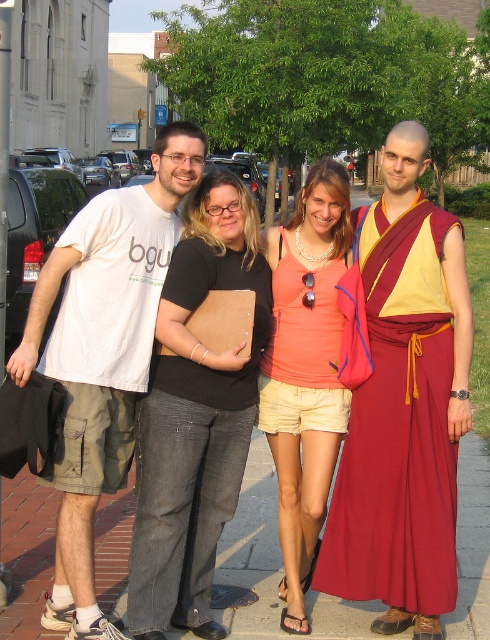
Which of these two, black cotton shirt at center or matte coral tank top at center, stands taller?

With more height is matte coral tank top at center.

From the picture: Is black cotton shirt at center smaller than matte coral tank top at center?

No.

Locate an element on the screen. black cotton shirt at center is located at coordinates (196, 416).

How much distance is there between white t-shirt at left and matte coral tank top at center?

They are 1.57 meters apart.

At what (x,y) coordinates should I click in order to perform the action: click on white t-shirt at left. Please return your answer as a coordinate pair (x, y). The width and height of the screenshot is (490, 640). Looking at the image, I should click on (102, 353).

You are a GUI agent. You are given a task and a screenshot of the screen. Output one action in this format:
    pyautogui.click(x=<x>, y=<y>)
    Task: Click on the white t-shirt at left
    The image size is (490, 640).
    Given the screenshot: What is the action you would take?
    pyautogui.click(x=102, y=353)

Between maroon silk robe at center and matte coral tank top at center, which one appears on the left side from the viewer's perspective?

From the viewer's perspective, matte coral tank top at center appears more on the left side.

Describe the element at coordinates (398, 428) in the screenshot. Image resolution: width=490 pixels, height=640 pixels. I see `maroon silk robe at center` at that location.

Identify the location of maroon silk robe at center. (398, 428).